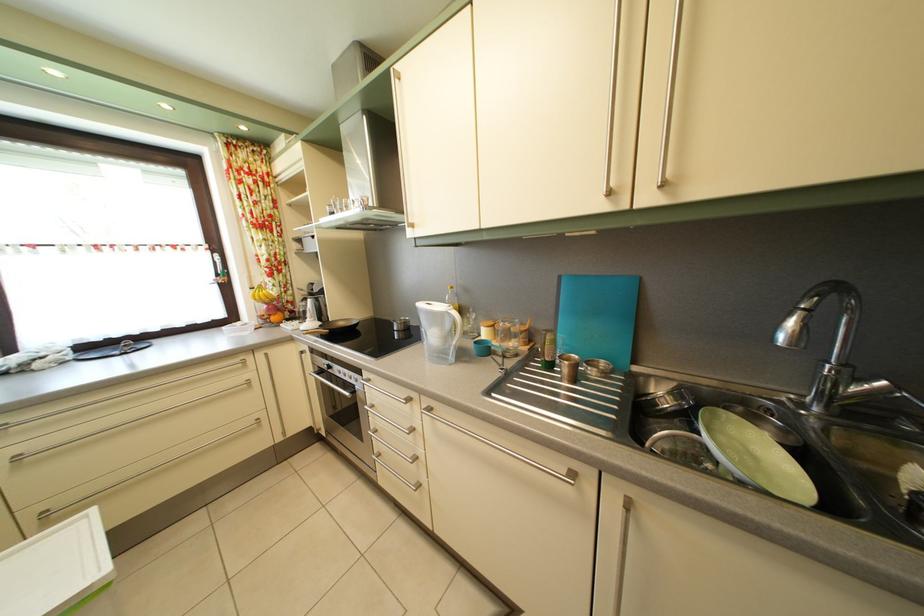
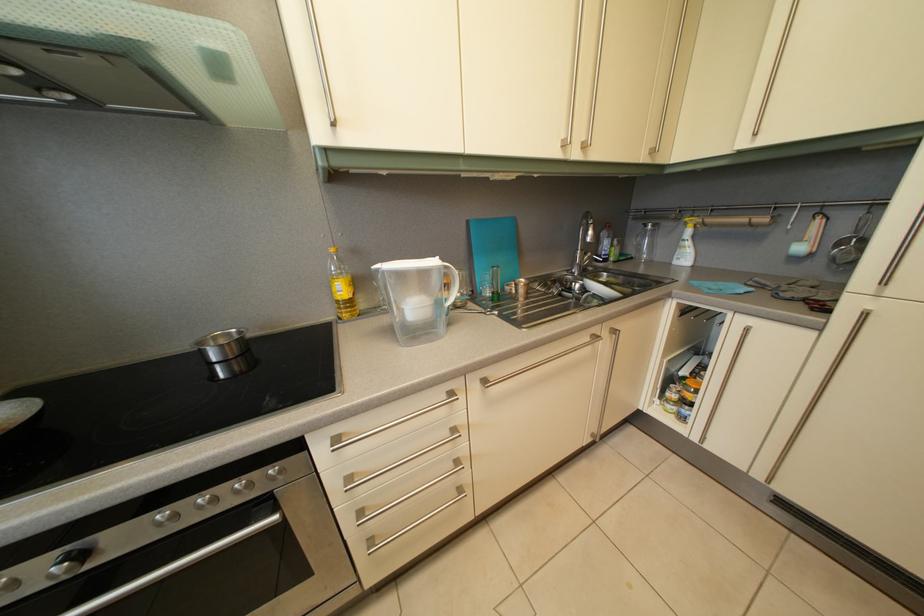
Locate, in the second image, the point that corresponds to (337,374) in the first image.

(92, 562)